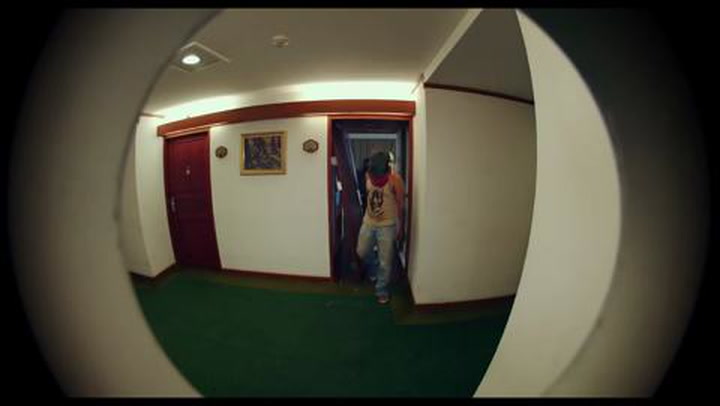
I want to click on brown closed door, so click(184, 185).